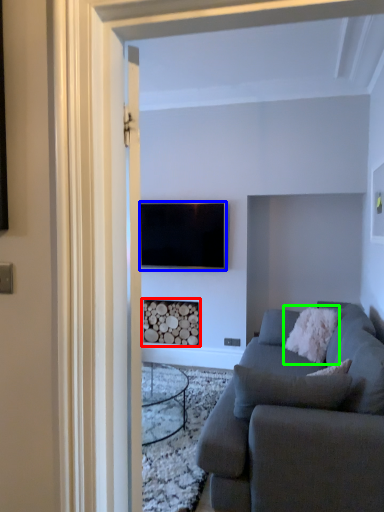
Question: Based on their relative distances, which object is nearer to fireplace (highlighted by a red box)? Choose from television (highlighted by a blue box) and pillow (highlighted by a green box).

Choices:
 (A) television
 (B) pillow

Answer: (A)